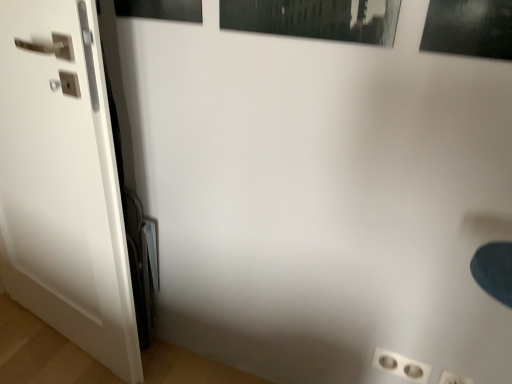
Question: Is matte black picture frame at upper left in front of or behind white plastic outlet at lower right in the image?

Choices:
 (A) behind
 (B) front

Answer: (B)

Question: From the image's perspective, is matte black picture frame at upper left positioned above or below white plastic outlet at lower right?

Choices:
 (A) below
 (B) above

Answer: (B)

Question: Which object is positioned farthest from the white plastic outlet at lower right?

Choices:
 (A) white glossy door at left
 (B) matte black picture frame at upper left

Answer: (B)

Question: Which is nearer to the matte black picture frame at upper left?

Choices:
 (A) white glossy door at left
 (B) white plastic outlet at lower right

Answer: (A)